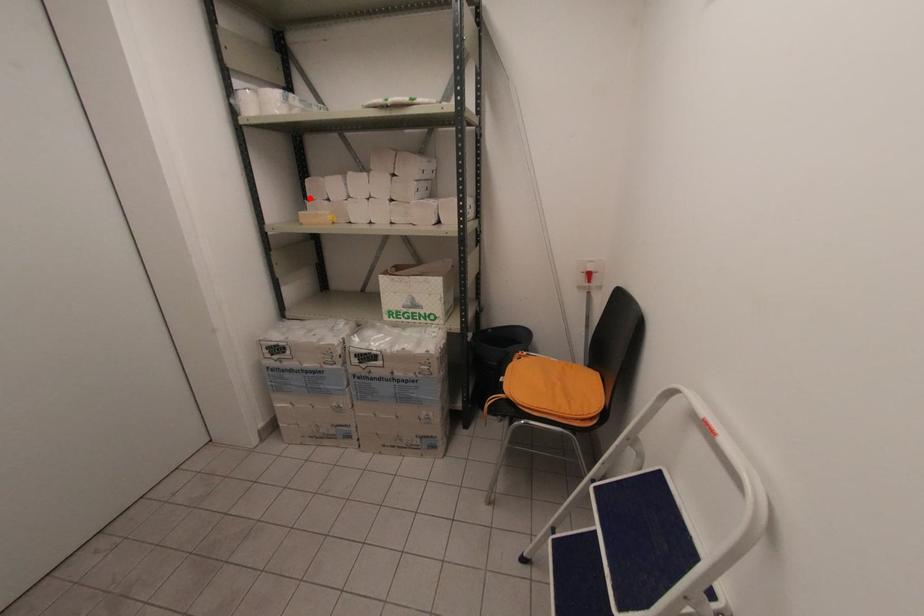
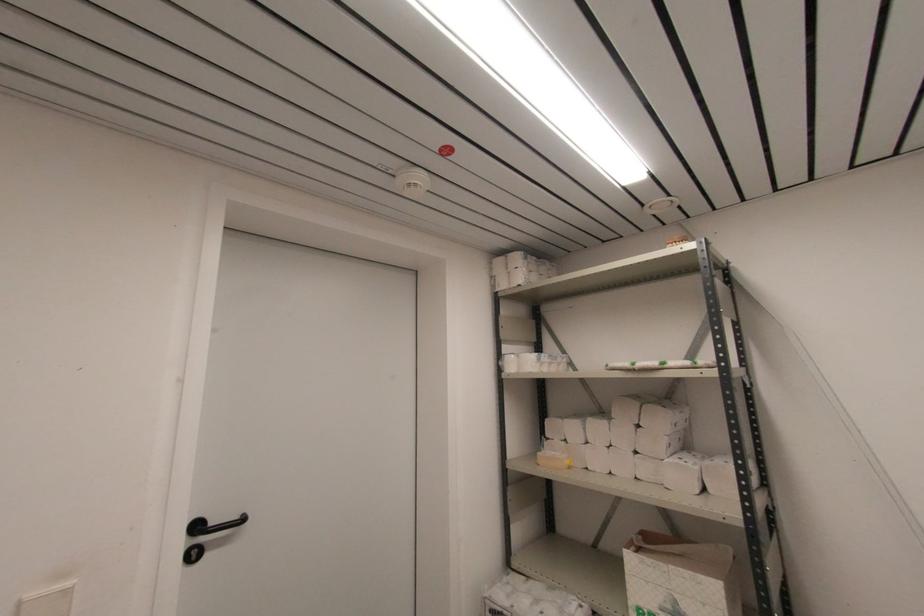
Question: I am providing you with two images of the same scene from different viewpoints. Image1 has a red point marked. In image2, the corresponding 3D location appears at what relative position? Reply with the corresponding letter.

Choices:
 (A) Closer
 (B) Farther

Answer: (B)